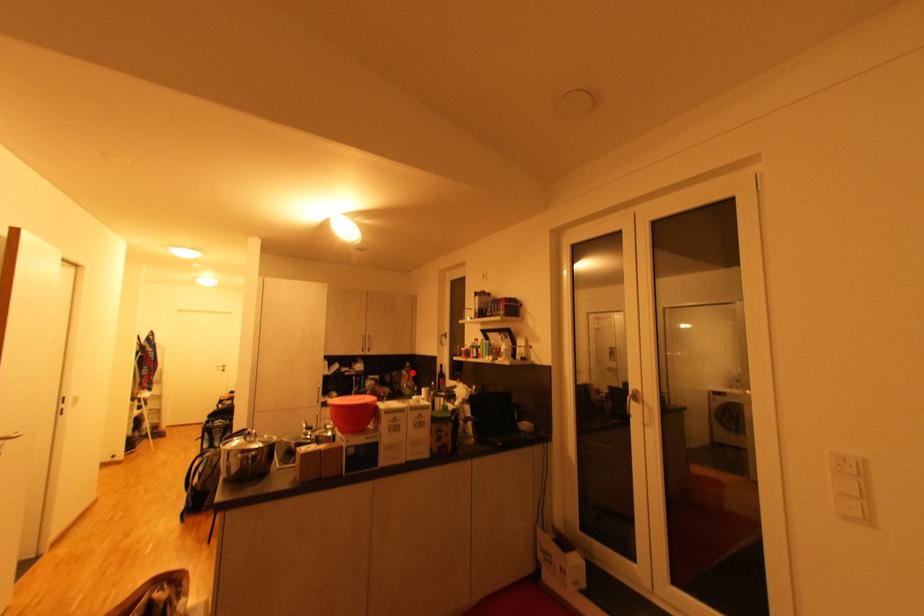
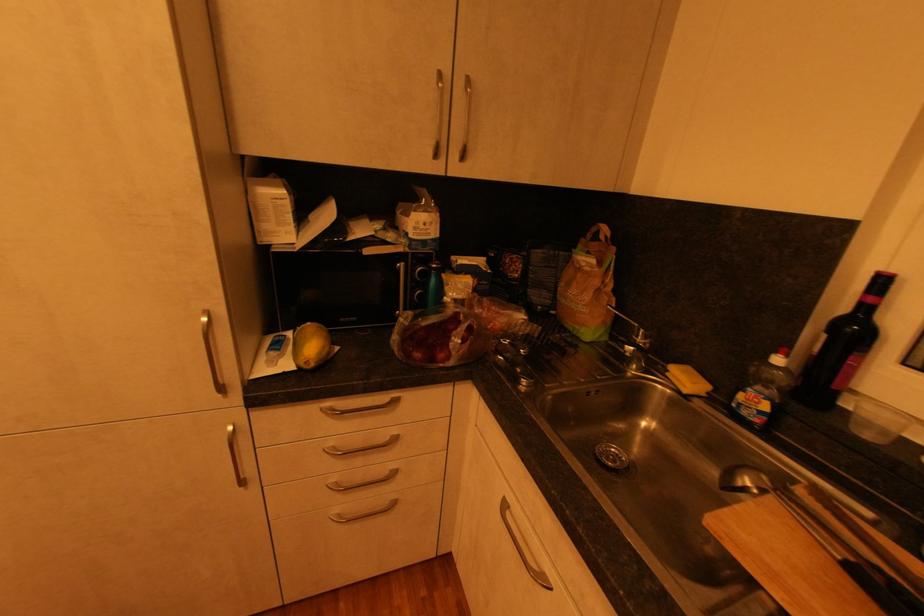
Find the pixel in the second image that matches the highlighted location in the first image.

(604, 264)